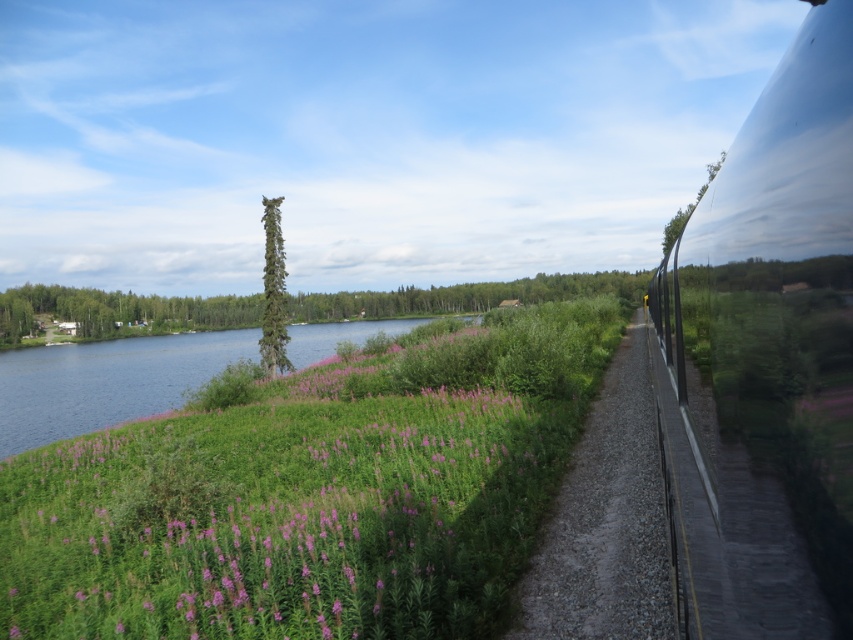
You are a photographer planning to capture the reflection of the green leafy tree at center in the glossy metallic train at right. Based on their positions, can you confirm if the train is positioned in a way that its reflective surface faces the tree?

The glossy metallic train at right is positioned on the right side of green leafy tree at center, so the reflective surface of the train faces away from the tree, making it unlikely to capture the tree in the reflection.

You are a photographer planning to capture a shot of the glossy metallic train at right and the green leafy tree at center. Based on their positions, which object would appear closer to the bottom of the photo?

The glossy metallic train at right is located below the green leafy tree at center, so it would appear closer to the bottom of the photo.

You are standing at the center of the image and want to walk to the gravel path at right. Which direction should you head towards?

The gravel path at right is located at point (606, 522), which is to the right side of the image. Therefore, you should head towards the right direction to reach it.